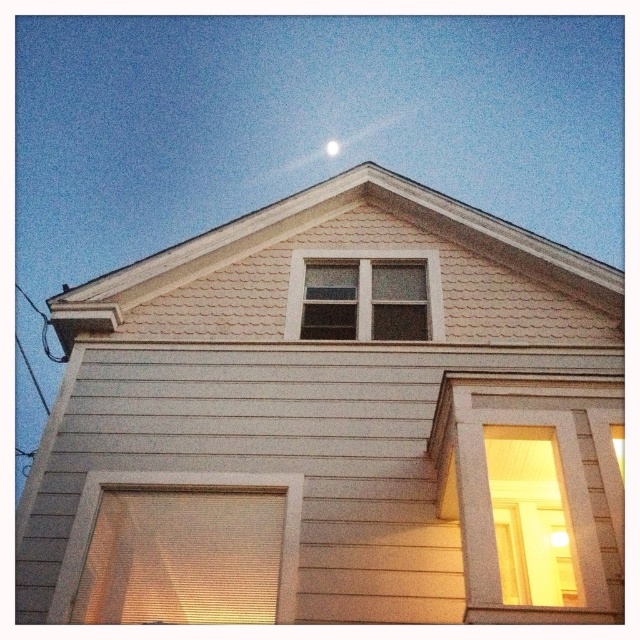
Question: Which object is farther from the camera taking this photo?

Choices:
 (A) translucent beige blinds at lower left
 (B) white wood siding at lower left
 (C) matte wooden door at right

Answer: (B)

Question: Which is farther from the matte wooden door at right?

Choices:
 (A) clear glass window at upper center
 (B) translucent beige blinds at lower left
 (C) white glossy moon at upper center

Answer: (C)

Question: Does matte wooden door at right have a larger size compared to translucent beige blinds at lower left?

Choices:
 (A) no
 (B) yes

Answer: (B)

Question: From the image, what is the correct spatial relationship of matte wooden door at right in relation to translucent beige blinds at lower left?

Choices:
 (A) above
 (B) below

Answer: (B)

Question: Is white wood siding at lower left further to camera compared to translucent beige blinds at lower left?

Choices:
 (A) no
 (B) yes

Answer: (B)

Question: Among these points, which one is nearest to the camera?

Choices:
 (A) (232, 365)
 (B) (333, 141)
 (C) (250, 484)
 (D) (348, 252)

Answer: (C)